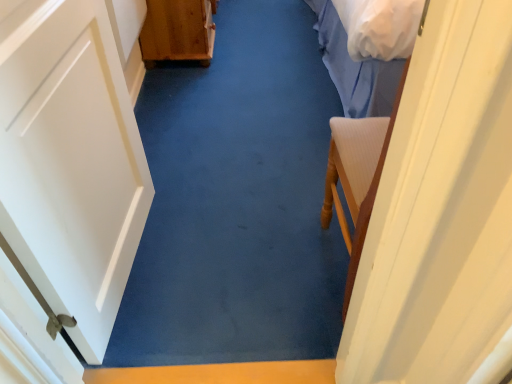
Find the location of `vacant area to the right of wooden chest at left`. vacant area to the right of wooden chest at left is located at coordinates (263, 25).